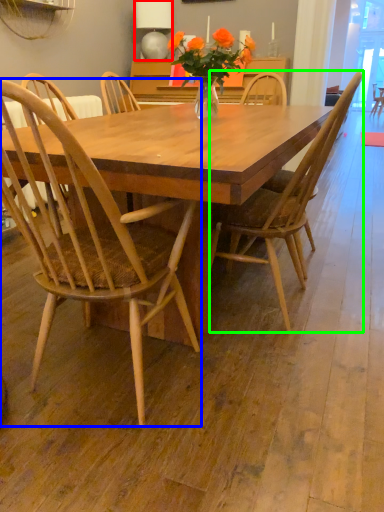
Question: Which object is the closest to the lamp (highlighted by a red box)? Choose among these: chair (highlighted by a blue box) or chair (highlighted by a green box).

Choices:
 (A) chair
 (B) chair

Answer: (B)